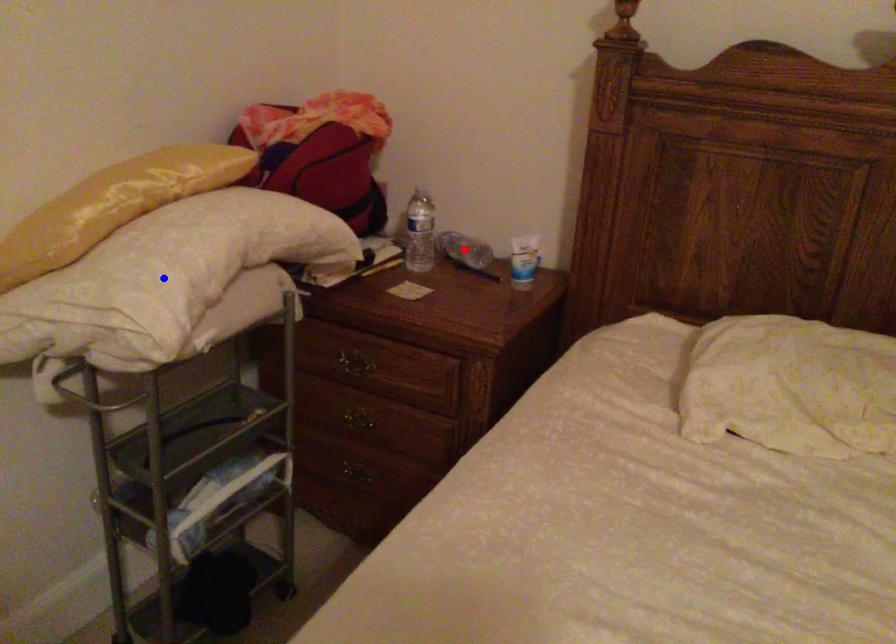
Question: Two points are marked on the image. Which point is closer to the camera?

Choices:
 (A) Blue point is closer.
 (B) Red point is closer.

Answer: (A)